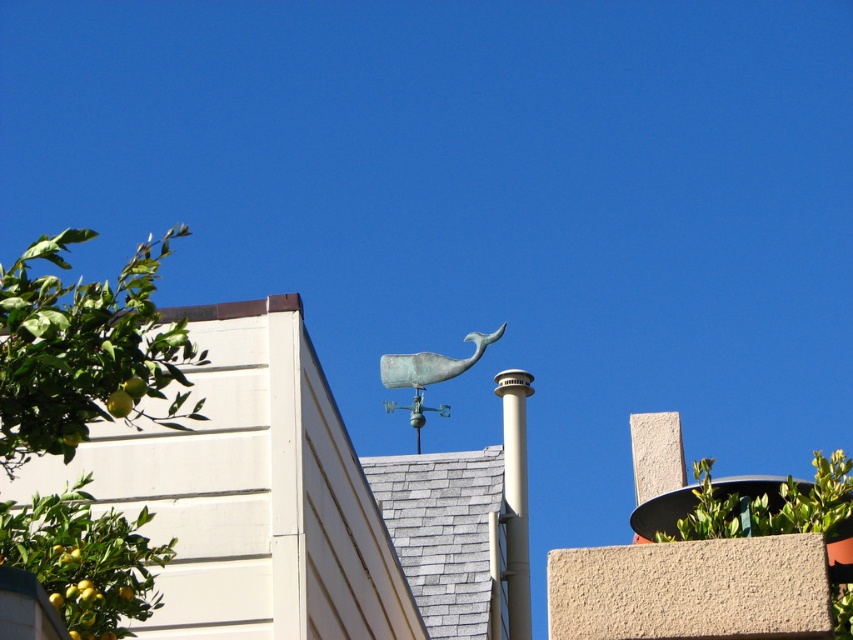
Who is lower down, green leafy tree at left or green patina whale at center?

green patina whale at center is below.

Who is more distant from viewer, (24,460) or (419,371)?

Point (419,371)

Is point (107, 538) farther from viewer compared to point (379, 374)?

No, (107, 538) is closer to viewer.

Identify the location of green leafy tree at left. (84, 349).

Does silver metallic chimney at center appear over green patina whale at center?

No, silver metallic chimney at center is not above green patina whale at center.

Who is taller, silver metallic chimney at center or green patina whale at center?

green patina whale at center is taller.

Image resolution: width=853 pixels, height=640 pixels. Identify the location of silver metallic chimney at center. (515, 497).

The image size is (853, 640). I want to click on silver metallic chimney at center, so click(515, 497).

Is green leafy tree at left further to camera compared to green leafy tree at upper center?

No, green leafy tree at left is closer to the viewer.

Between point (61, 582) and point (838, 472), which one is positioned in front?

Point (61, 582) is more forward.

Find the location of a particular element. The image size is (853, 640). green leafy tree at left is located at coordinates (84, 349).